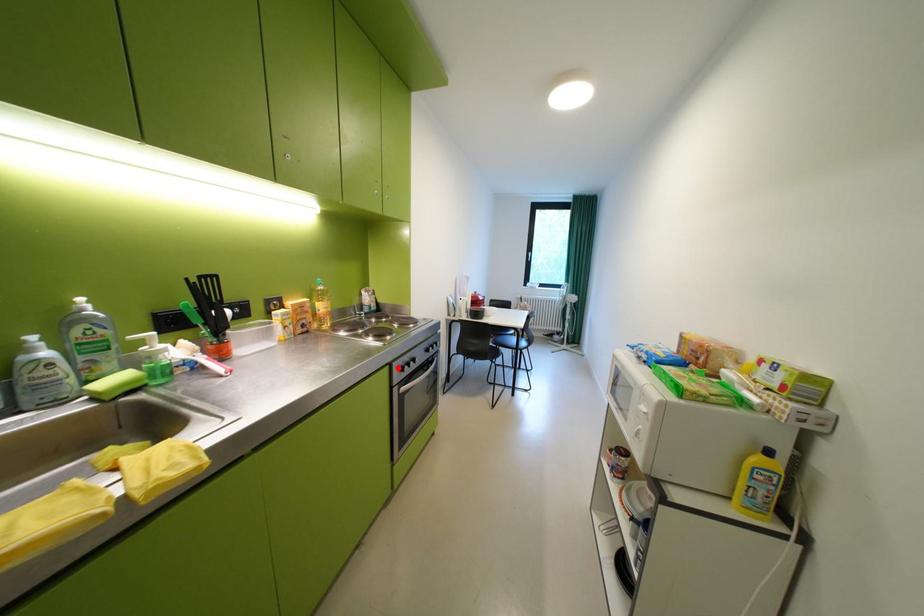
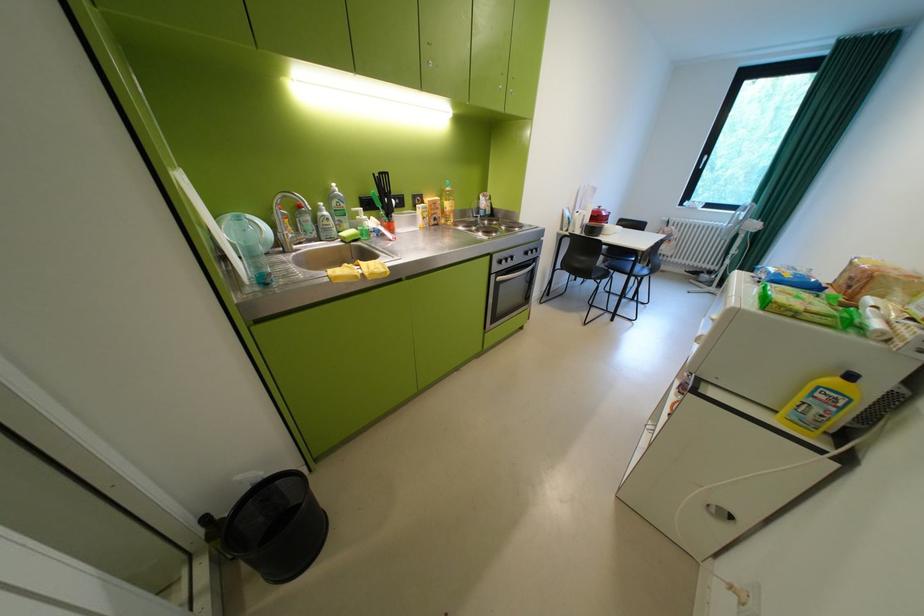
The point at the highlighted location is marked in the first image. Where is the corresponding point in the second image?

(499, 257)